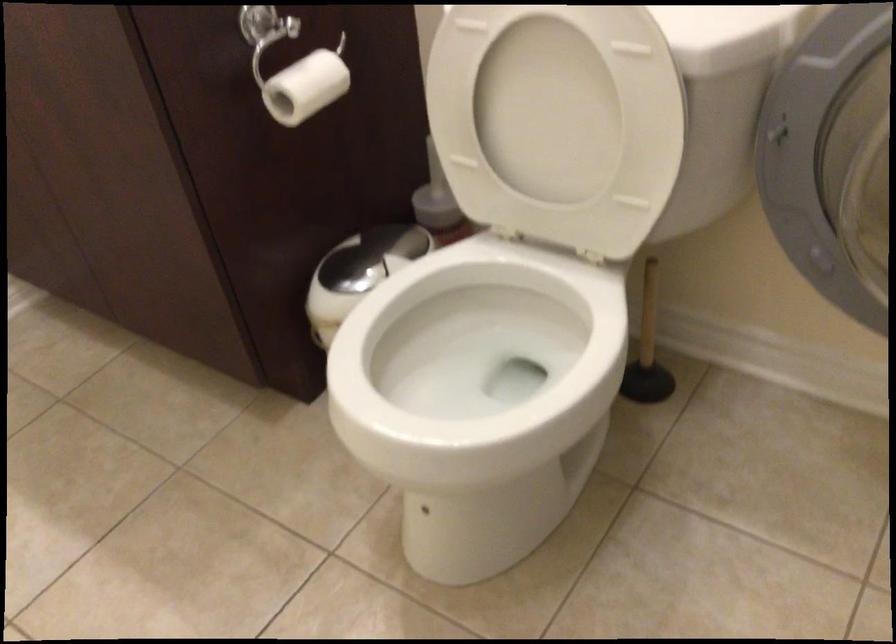
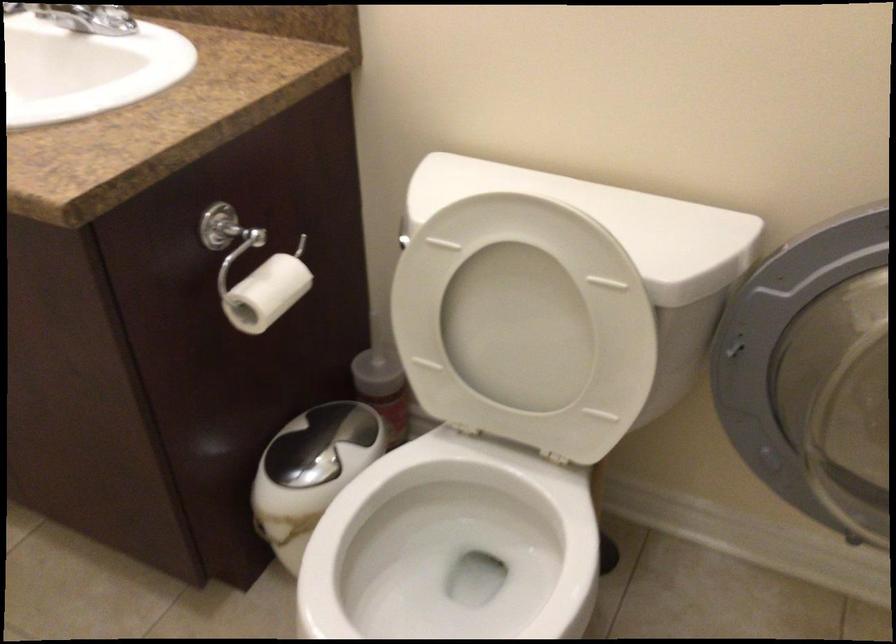
The point at (547, 117) is marked in the first image. Where is the corresponding point in the second image?

(517, 328)